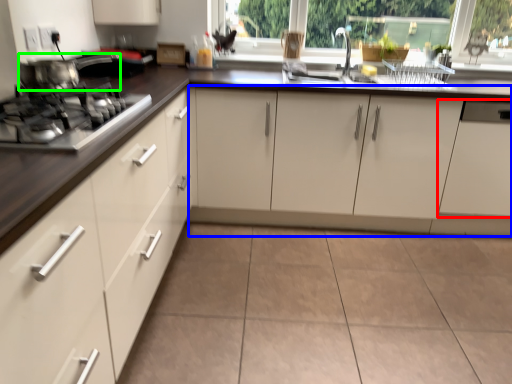
Question: Which object is positioned closest to cabinetry (highlighted by a red box)? Select from cabinetry (highlighted by a blue box) and home appliance (highlighted by a green box).

Choices:
 (A) cabinetry
 (B) home appliance

Answer: (A)